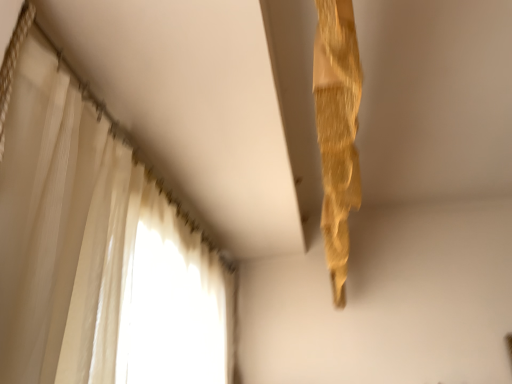
Question: From a real-world perspective, is gold textured curtain at upper right, the 1th curtain in the right-to-left sequence, positioned above or below white sheer curtain at left, which appears as the 1th curtain when viewed from the left?

Choices:
 (A) below
 (B) above

Answer: (A)

Question: Does point (329, 266) appear closer or farther from the camera than point (1, 283)?

Choices:
 (A) farther
 (B) closer

Answer: (A)

Question: In terms of width, does gold textured curtain at upper right, which appears as the 2th curtain when viewed from the left, look wider or thinner when compared to white sheer curtain at left, arranged as the 2th curtain when viewed from the right?

Choices:
 (A) thin
 (B) wide

Answer: (A)

Question: In the image, is white sheer curtain at left, which appears as the 1th curtain when viewed from the left, on the left side or the right side of gold textured curtain at upper right, the 1th curtain in the right-to-left sequence?

Choices:
 (A) left
 (B) right

Answer: (A)

Question: Does point (71, 286) appear closer or farther from the camera than point (327, 8)?

Choices:
 (A) closer
 (B) farther

Answer: (B)

Question: Relative to gold textured curtain at upper right, which appears as the 2th curtain when viewed from the left, is white sheer curtain at left, arranged as the 2th curtain when viewed from the right, in front or behind?

Choices:
 (A) behind
 (B) front

Answer: (B)

Question: Considering the positions of white sheer curtain at left, arranged as the 2th curtain when viewed from the right, and gold textured curtain at upper right, which appears as the 2th curtain when viewed from the left, in the image, is white sheer curtain at left, arranged as the 2th curtain when viewed from the right, wider or thinner than gold textured curtain at upper right, which appears as the 2th curtain when viewed from the left,?

Choices:
 (A) thin
 (B) wide

Answer: (B)